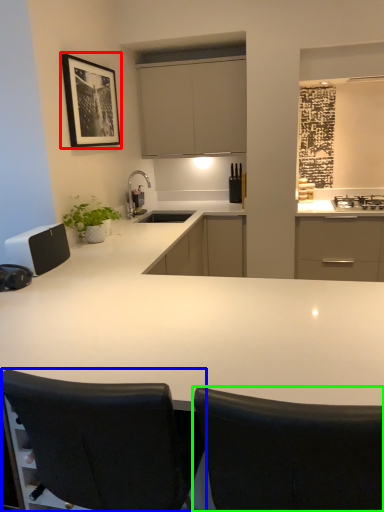
Question: Which object is positioned farthest from picture frame (highlighted by a red box)? Select from chair (highlighted by a blue box) and chair (highlighted by a green box).

Choices:
 (A) chair
 (B) chair

Answer: (B)